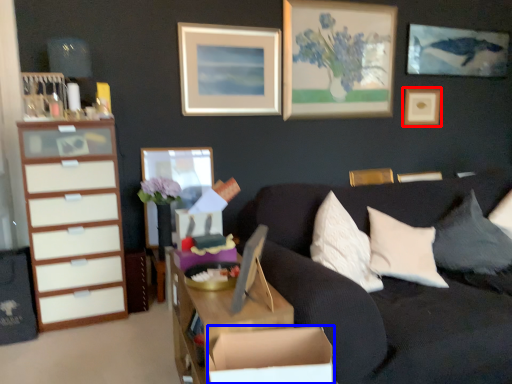
Question: Which point is further to the camera, picture frame (highlighted by a red box) or cardboard box (highlighted by a blue box)?

Choices:
 (A) picture frame
 (B) cardboard box

Answer: (A)